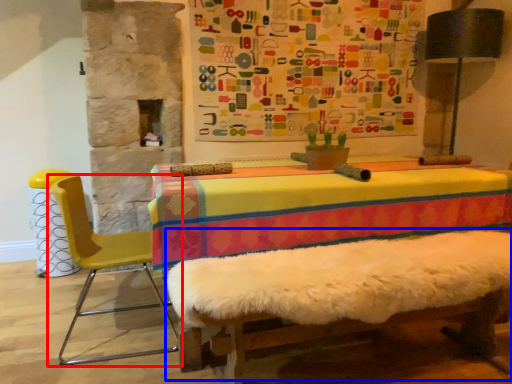
Question: Which object is further to the camera taking this photo, chair (highlighted by a red box) or bed frame (highlighted by a blue box)?

Choices:
 (A) chair
 (B) bed frame

Answer: (A)